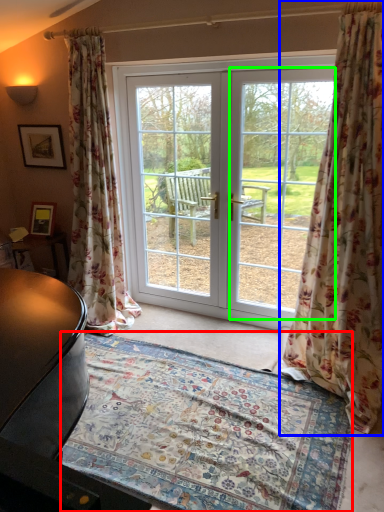
Question: Which object is the closest to the mat (highlighted by a red box)? Choose among these: curtain (highlighted by a blue box) or window screen (highlighted by a green box).

Choices:
 (A) curtain
 (B) window screen

Answer: (A)